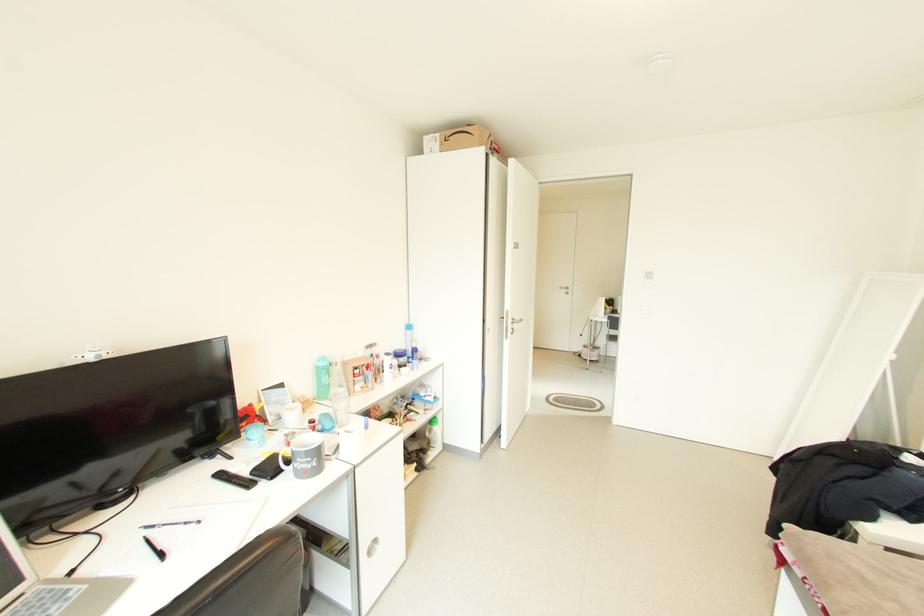
The image size is (924, 616). Describe the element at coordinates (154, 548) in the screenshot. I see `the black pen` at that location.